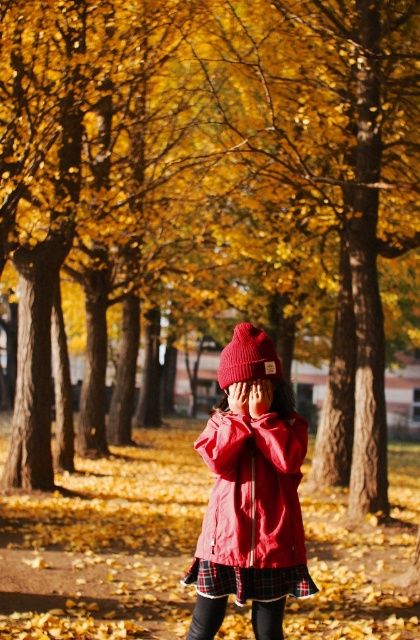
Question: Is matte red coat at center wider than matte red jacket at center?

Choices:
 (A) no
 (B) yes

Answer: (B)

Question: Which object is farther from the camera taking this photo?

Choices:
 (A) matte red coat at center
 (B) knitted woolen beanie at center

Answer: (B)

Question: Is matte red coat at center smaller than knitted woolen beanie at center?

Choices:
 (A) no
 (B) yes

Answer: (A)

Question: Which point is closer to the camera?

Choices:
 (A) matte red coat at center
 (B) matte red jacket at center
 (C) knitted woolen beanie at center

Answer: (A)

Question: Which of the following is the closest to the observer?

Choices:
 (A) matte red jacket at center
 (B) matte red coat at center
 (C) knitted woolen beanie at center

Answer: (B)

Question: From the image, what is the correct spatial relationship of matte red coat at center in relation to knitted woolen beanie at center?

Choices:
 (A) left
 (B) right

Answer: (A)